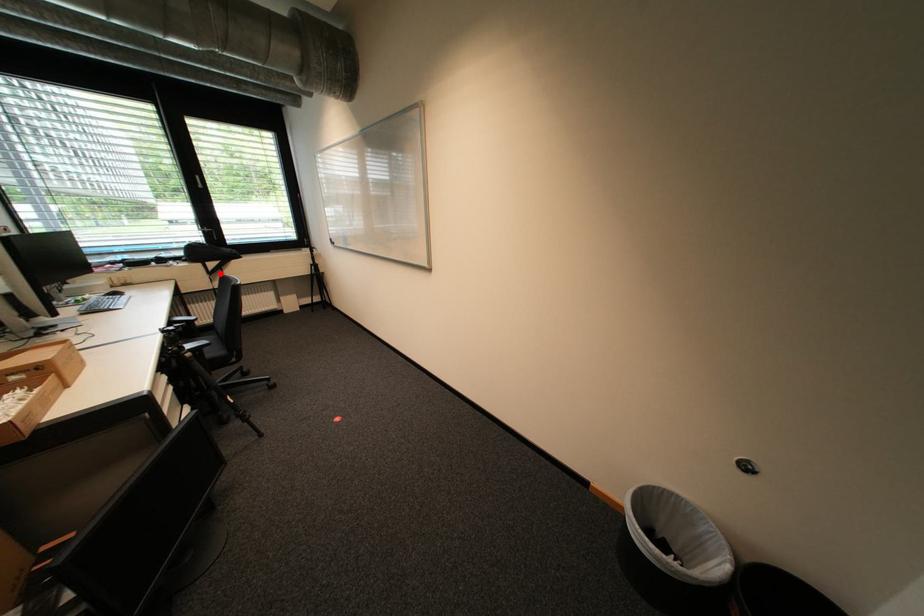
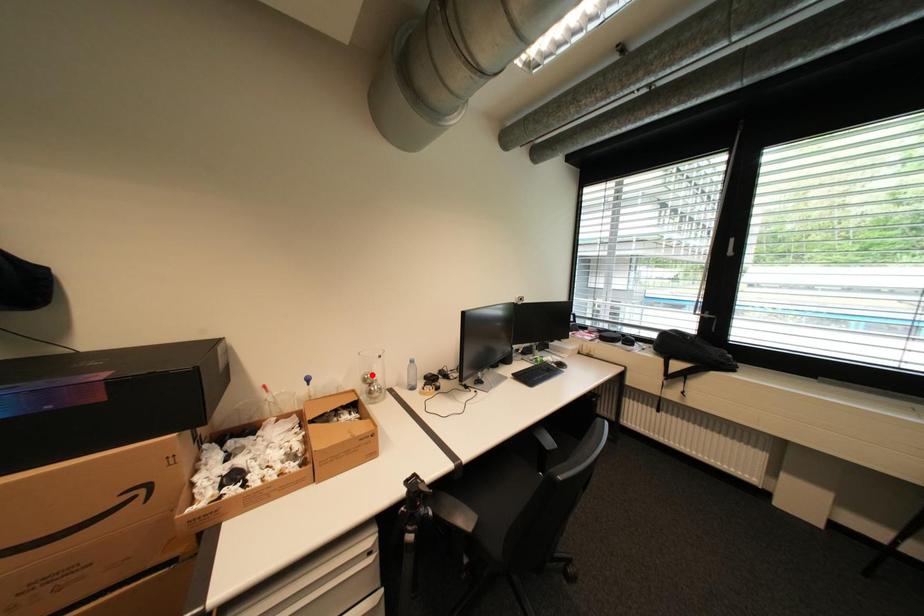
I am providing you with two images of the same scene from different viewpoints. A red point is marked on the first image and another point is marked on the second image. Is the marked point in image1 the same physical position as the marked point in image2?

No